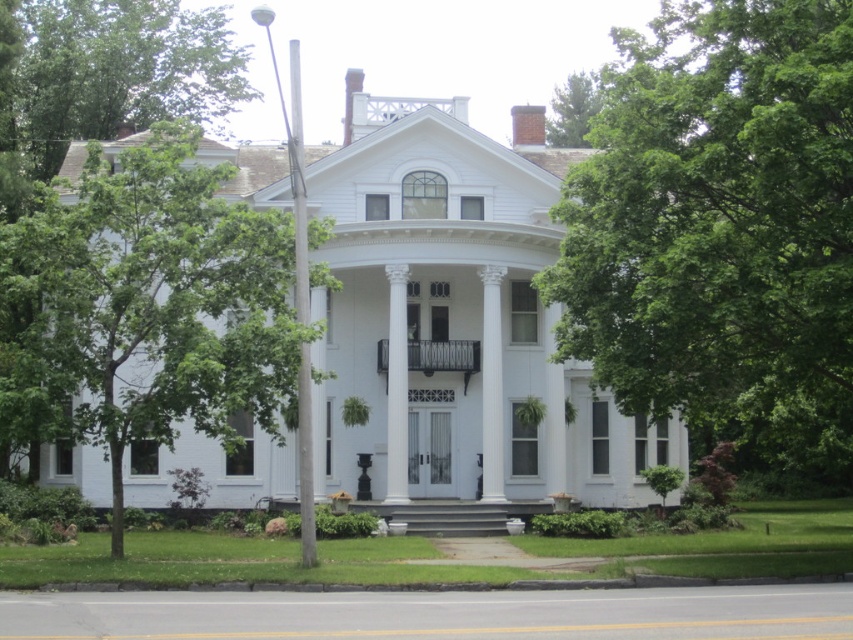
You are standing in front of the house and notice the white smooth column at center and the green leafy tree at upper center. Which object is positioned to the left when viewed from the front?

The white smooth column at center is to the left of the green leafy tree at upper center when viewed from the front.

You are a painter standing at the base of the house, and you need to paint both the white glossy column at center and the polished metal railing at center. If your ladder can reach up to 3 meters, can you safely paint both without moving the ladder?

The distance between the white glossy column at center and the polished metal railing at center is 3.44 meters, which exceeds the ladder height of 3 meters. Therefore, you cannot safely paint both without moving the ladder.

You are standing in front of the two story white house and want to plant a new tree in your backyard. The existing green leafy tree at center is currently at point 0.358, 0.845. Where should you place the new tree to ensure it is not directly behind the house from the front view?

The green leafy tree at center is located at point (720, 228), so to avoid placing the new tree directly behind the house from the front view, you should position it either to the left or right of this coordinate, ensuring it does not align with the house facade.